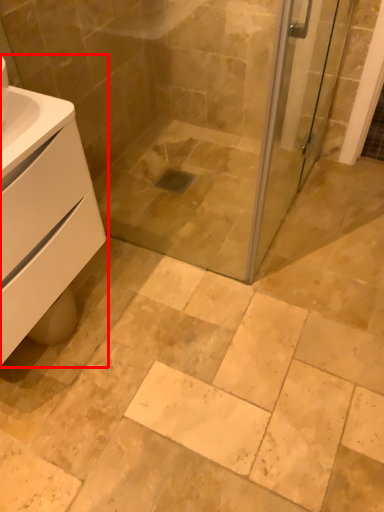
Question: In this image, where is bathroom cabinet (annotated by the red box) located relative to screen door?

Choices:
 (A) right
 (B) left

Answer: (B)